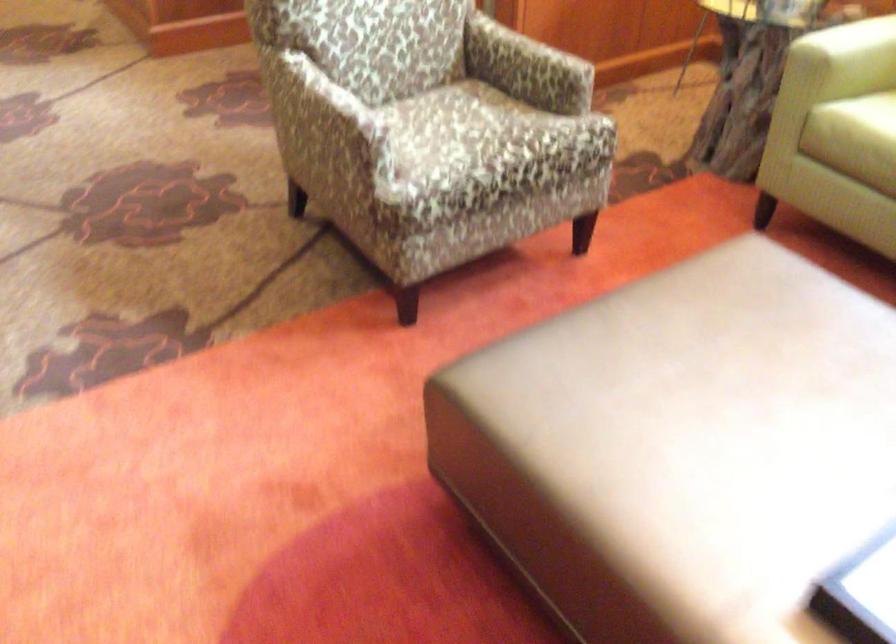
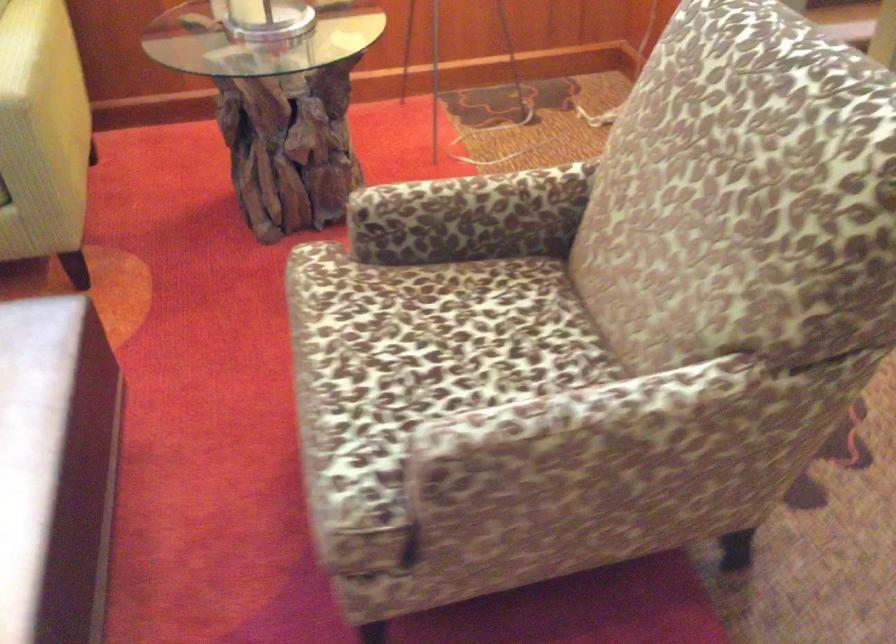
Based on the continuous images, in which direction is the camera rotating?

The camera's rotation is toward right-down.